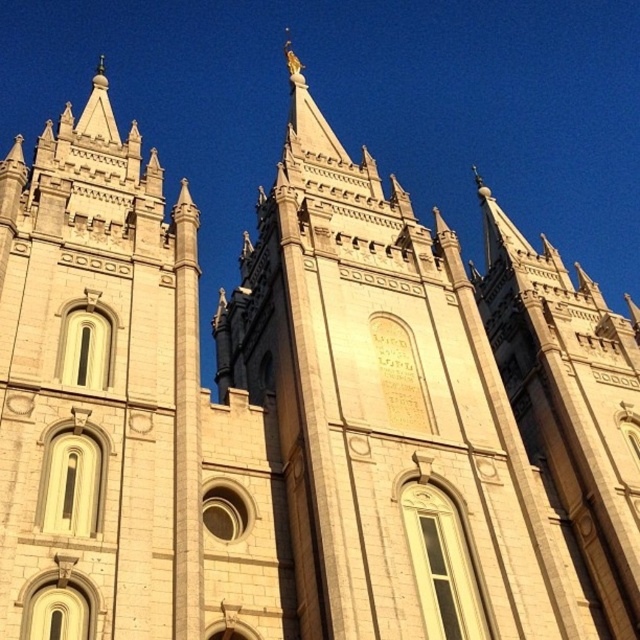
Question: From the image, what is the correct spatial relationship of white stone tower at center in relation to beige stone tower at right?

Choices:
 (A) below
 (B) above

Answer: (B)

Question: Considering the relative positions of white stone tower at center and beige stone tower at right in the image provided, where is white stone tower at center located with respect to beige stone tower at right?

Choices:
 (A) below
 (B) above

Answer: (B)

Question: In this image, where is white stone tower at center located relative to beige stone tower at right?

Choices:
 (A) below
 (B) above

Answer: (B)